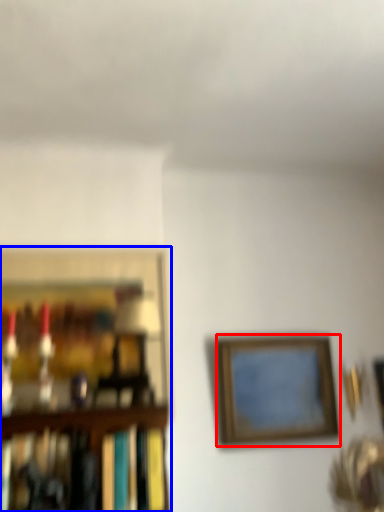
Question: Which object is closer to the camera taking this photo, picture frame (highlighted by a red box) or picture frame (highlighted by a blue box)?

Choices:
 (A) picture frame
 (B) picture frame

Answer: (B)